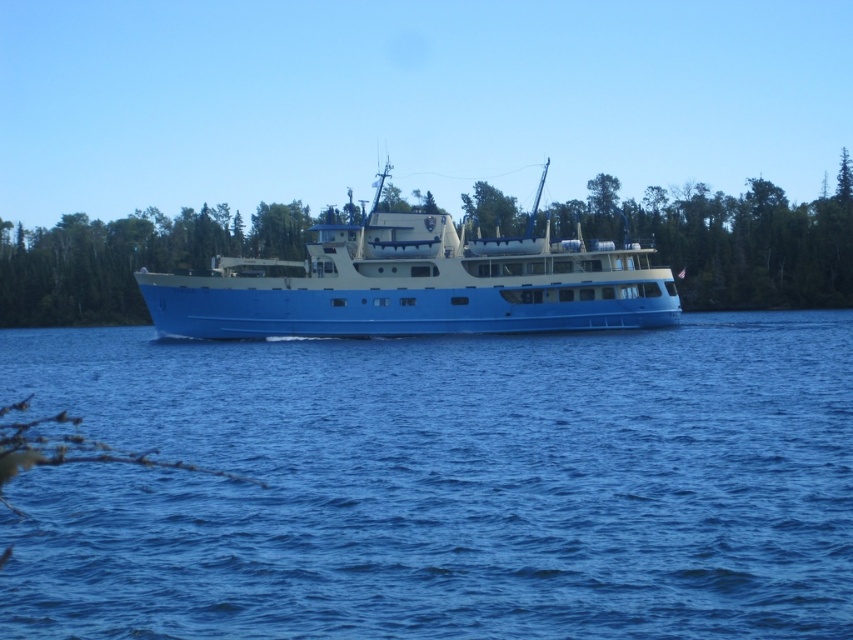
Question: Which of the following is the closest to the observer?

Choices:
 (A) (242, 328)
 (B) (120, 564)

Answer: (B)

Question: From the image, what is the correct spatial relationship of blue liquid water at center in relation to blue matte boat at center?

Choices:
 (A) below
 (B) above

Answer: (A)

Question: Can you confirm if blue liquid water at center is thinner than blue matte boat at center?

Choices:
 (A) yes
 (B) no

Answer: (B)

Question: Where is blue liquid water at center located in relation to blue matte boat at center in the image?

Choices:
 (A) left
 (B) right

Answer: (A)